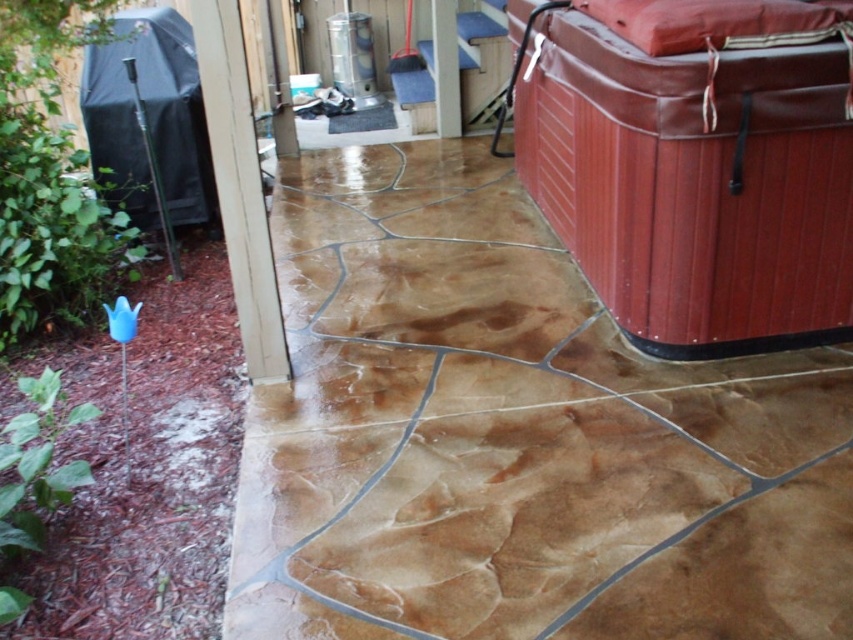
Can you confirm if brown textured concrete at center is positioned to the left of brown textured hot tub at right?

Indeed, brown textured concrete at center is positioned on the left side of brown textured hot tub at right.

Looking at this image, who is taller, brown textured concrete at center or brown textured hot tub at right?

Standing taller between the two is brown textured hot tub at right.

Where is `brown textured concrete at center`? brown textured concrete at center is located at coordinates (x=515, y=436).

Does brown textured hot tub at right appear over brown textured tile at center?

Indeed, brown textured hot tub at right is positioned over brown textured tile at center.

Who is higher up, brown textured hot tub at right or brown textured tile at center?

Positioned higher is brown textured hot tub at right.

Locate an element on the screen. This screenshot has width=853, height=640. brown textured hot tub at right is located at coordinates (695, 163).

Is brown textured concrete at center thinner than brown textured tile at center?

No.

Is point (392, 438) more distant than point (421, 307)?

No, (392, 438) is closer to viewer.

This screenshot has width=853, height=640. What are the coordinates of `brown textured concrete at center` in the screenshot? It's located at (515, 436).